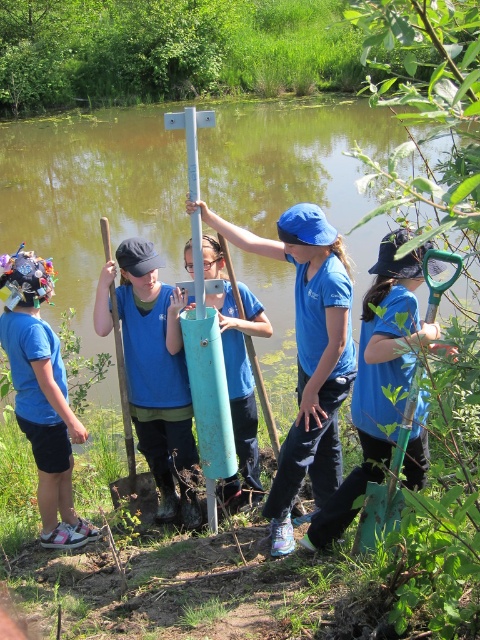
Question: Can you confirm if green metallic pole at center is positioned above matte blue cylinder at center?

Choices:
 (A) yes
 (B) no

Answer: (A)

Question: Can you confirm if wooden shovel at center is positioned to the left of metallic silver pole at center?

Choices:
 (A) no
 (B) yes

Answer: (B)

Question: Which object is the farthest from the green metallic pole at center?

Choices:
 (A) matte blue shirt at left
 (B) green plastic shovel at lower right

Answer: (B)

Question: Does teal matte cylinder at center have a greater width compared to green plastic shovel at lower right?

Choices:
 (A) no
 (B) yes

Answer: (B)

Question: Which point is closer to the camera taking this photo?

Choices:
 (A) (259, 248)
 (B) (116, 323)
 (C) (262, 280)

Answer: (A)

Question: Which point is farther to the camera?

Choices:
 (A) wooden shovel at center
 (B) teal matte cylinder at center

Answer: (A)